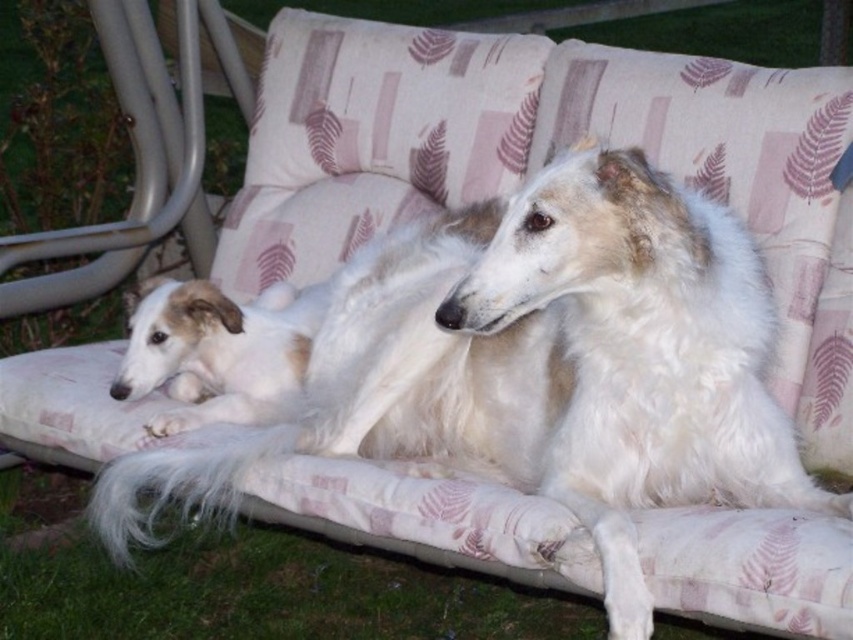
Question: Which of the following is the closest to the observer?

Choices:
 (A) (134, 342)
 (B) (415, 308)

Answer: (B)

Question: Is white fluffy dog at center bigger than light brown fur at center?

Choices:
 (A) no
 (B) yes

Answer: (B)

Question: Can you confirm if white fluffy dog at center is positioned to the right of light brown fur at center?

Choices:
 (A) yes
 (B) no

Answer: (A)

Question: Which of the following is the farthest from the observer?

Choices:
 (A) click(x=193, y=369)
 (B) click(x=523, y=230)

Answer: (A)

Question: In this image, where is white fluffy dog at center located relative to light brown fur at center?

Choices:
 (A) above
 (B) below

Answer: (B)

Question: Which of the following is the closest to the observer?

Choices:
 (A) (635, 624)
 (B) (281, 323)

Answer: (A)